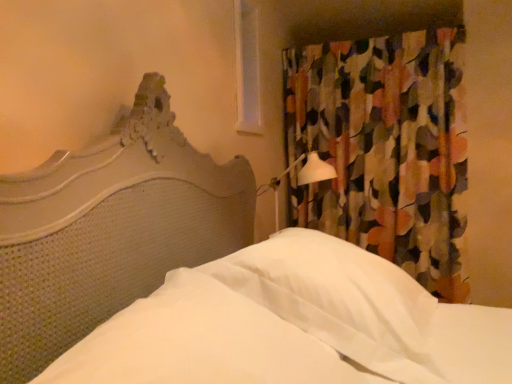
Question: From a real-world perspective, is multicolored fabric curtain at upper right positioned above or below white fabric sheet at center?

Choices:
 (A) above
 (B) below

Answer: (A)

Question: Looking at their shapes, would you say multicolored fabric curtain at upper right is wider or thinner than white fabric sheet at center?

Choices:
 (A) wide
 (B) thin

Answer: (B)

Question: Which object is the closest to the white soft pillow at center?

Choices:
 (A) multicolored fabric curtain at upper right
 (B) white fabric sheet at center
 (C) white plastic window at upper center

Answer: (B)

Question: Which of these objects is positioned closest to the white soft pillow at center?

Choices:
 (A) multicolored fabric curtain at upper right
 (B) white plastic window at upper center
 (C) white fabric sheet at center

Answer: (C)